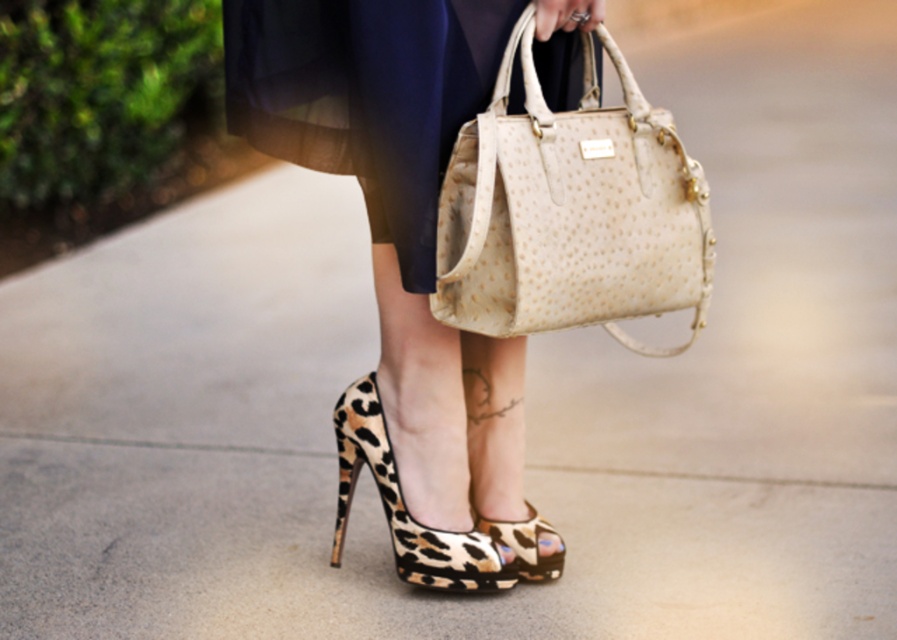
Question: Estimate the real-world distances between objects in this image. Which object is farther from the leopard print fabric high-heeled shoe at lower center?

Choices:
 (A) leopard print heels at center
 (B) leather textured bag at center
 (C) leopard print suede sandal at lower center
 (D) navy blue fabric dress at center

Answer: (D)

Question: Estimate the real-world distances between objects in this image. Which object is farther from the leopard print suede sandal at lower center?

Choices:
 (A) leopard print fabric high-heeled shoe at lower center
 (B) leather textured bag at center
 (C) navy blue fabric dress at center
 (D) leopard print heels at center

Answer: (B)

Question: Which object is closer to the camera taking this photo?

Choices:
 (A) leopard print heels at center
 (B) leopard print suede sandal at lower center
 (C) leopard print fabric high-heeled shoe at lower center

Answer: (A)

Question: Can you confirm if leather textured bag at center is wider than navy blue fabric dress at center?

Choices:
 (A) no
 (B) yes

Answer: (A)

Question: Does navy blue fabric dress at center appear on the left side of leopard print fabric high-heeled shoe at lower center?

Choices:
 (A) yes
 (B) no

Answer: (A)

Question: Can you confirm if leopard print heels at center is positioned above leopard print suede sandal at lower center?

Choices:
 (A) no
 (B) yes

Answer: (B)